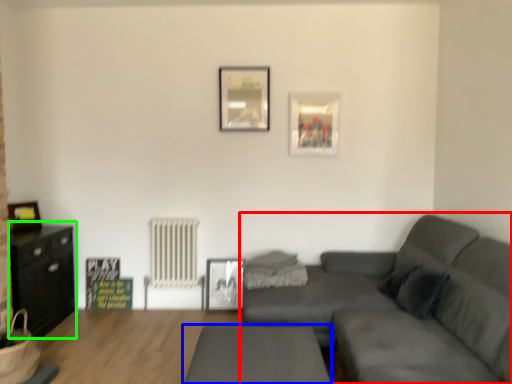
Question: Considering the real-world distances, which object is farthest from studio couch (highlighted by a red box)? table (highlighted by a blue box) or entertainment center (highlighted by a green box)?

Choices:
 (A) table
 (B) entertainment center

Answer: (B)